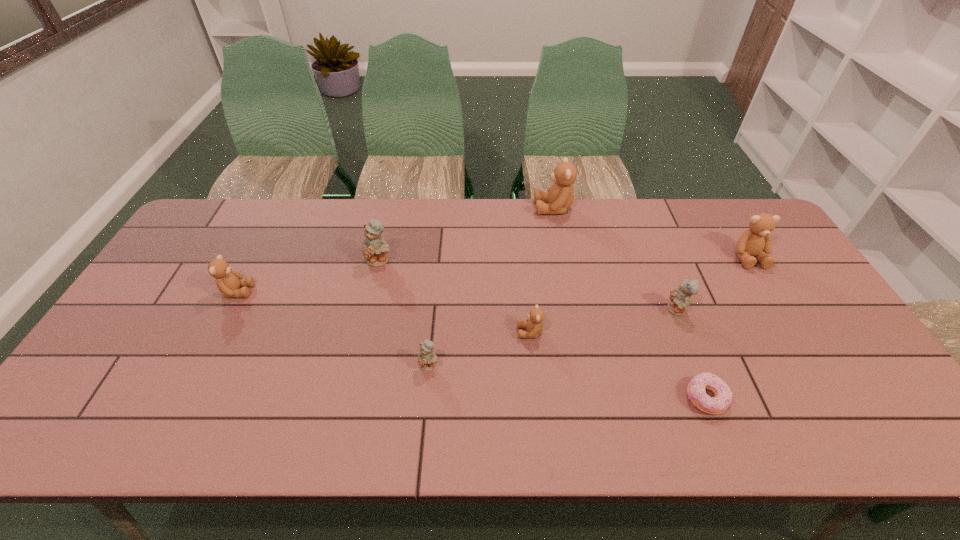
The image size is (960, 540). Identify the location of the farthest teddy bear. 560,196.

Find the location of a particular element. the farthest object is located at coordinates (560, 196).

The height and width of the screenshot is (540, 960). I want to click on the second object from left to right, so click(375, 248).

The image size is (960, 540). I want to click on the farthest blue teddy bear, so click(x=375, y=248).

The width and height of the screenshot is (960, 540). Find the location of `the rightmost object`. the rightmost object is located at coordinates (756, 242).

Where is `the rightmost brown teddy bear`? This screenshot has width=960, height=540. the rightmost brown teddy bear is located at coordinates [756, 242].

Find the location of a particular element. This screenshot has width=960, height=540. the second teddy bear from right to left is located at coordinates (680, 298).

Find the location of a particular element. This screenshot has height=540, width=960. the rightmost blue teddy bear is located at coordinates tap(680, 298).

This screenshot has width=960, height=540. Identify the location of the leftmost teddy bear. (228, 281).

Find the location of `the third farthest brown teddy bear`. the third farthest brown teddy bear is located at coordinates (228, 281).